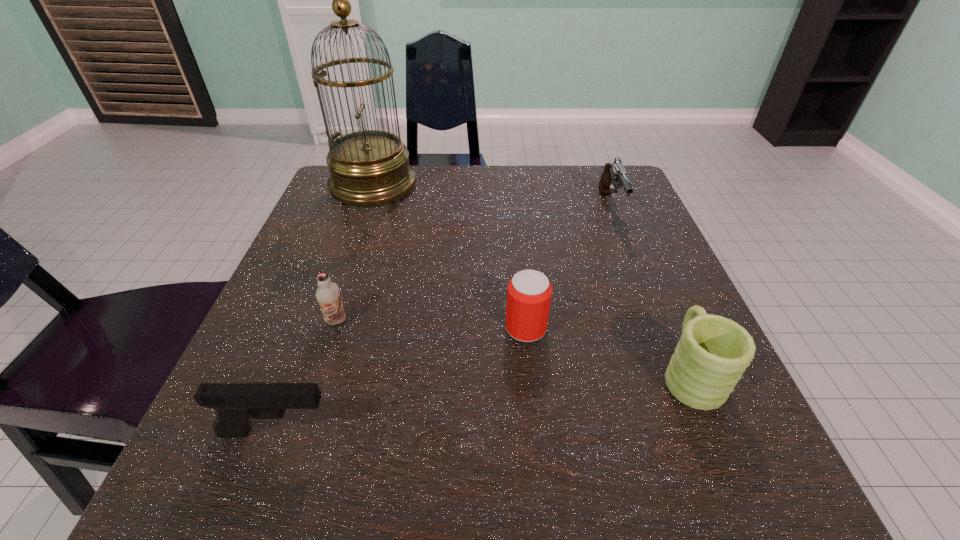
Locate an element on the screen. This screenshot has height=540, width=960. blank space located on the side of the mug with the handle is located at coordinates (642, 261).

At what (x,y) coordinates should I click in order to perform the action: click on vacant space located 0.320m on the side of the mug with the handle. Please return your answer as a coordinate pair (x, y). Looking at the image, I should click on (627, 225).

Where is `free region located on the right of the chocolate milk`? free region located on the right of the chocolate milk is located at coordinates (550, 321).

You are a GUI agent. You are given a task and a screenshot of the screen. Output one action in this format:
    pyautogui.click(x=<x>, y=<y>)
    Task: Click on the free space located on the right of the beer can
    This screenshot has width=960, height=540.
    Given the screenshot: What is the action you would take?
    pyautogui.click(x=656, y=328)

Locate an element on the screen. This screenshot has width=960, height=540. free region located on the front-facing side of the nearest object is located at coordinates (628, 432).

This screenshot has height=540, width=960. Find the location of `birdcage at the far edge`. birdcage at the far edge is located at coordinates (370, 167).

Image resolution: width=960 pixels, height=540 pixels. I want to click on pistol located in the far edge section of the desktop, so click(614, 176).

Where is `object that is positioned at the near edge`? The width and height of the screenshot is (960, 540). object that is positioned at the near edge is located at coordinates (235, 403).

Where is `birdcage situated at the left edge`? This screenshot has width=960, height=540. birdcage situated at the left edge is located at coordinates (370, 167).

Locate an element on the screen. This screenshot has width=960, height=540. chocolate milk that is positioned at the left edge is located at coordinates (328, 294).